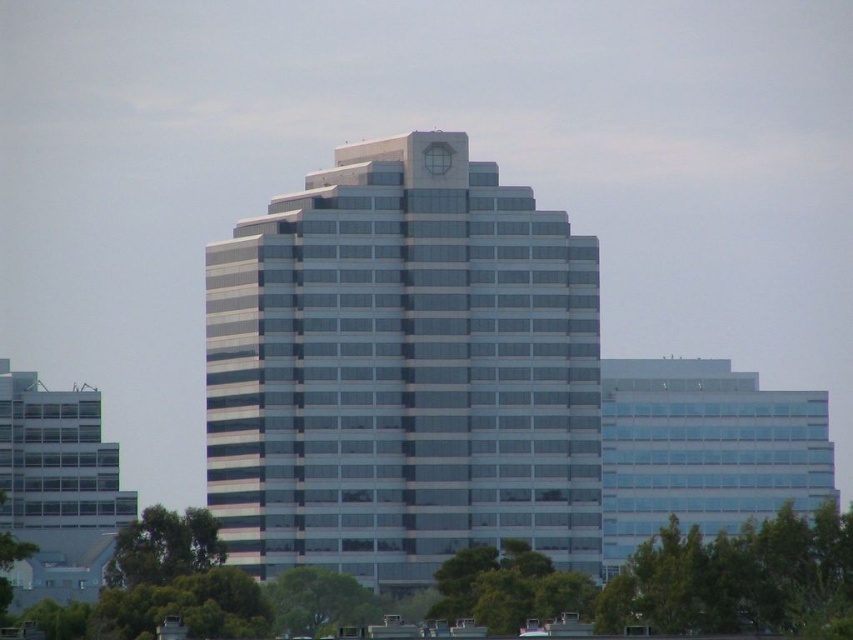
Who is shorter, glassy reflective building at center or matte glass building at left?

matte glass building at left is shorter.

Which is behind, point (454, 163) or point (26, 493)?

The point (26, 493) is behind.

This screenshot has height=640, width=853. I want to click on glassy reflective building at center, so pyautogui.click(x=402, y=371).

Between transparent glass building at right and matte glass building at left, which one has more height?

matte glass building at left

Is point (654, 513) behind point (59, 518)?

That is False.

The image size is (853, 640). Identify the location of transparent glass building at right. (703, 449).

Is point (515, 291) farther from camera compared to point (128, 538)?

No, (515, 291) is in front of (128, 538).

Does glassy reflective building at center appear on the right side of green leafy tree at lower left?

Indeed, glassy reflective building at center is positioned on the right side of green leafy tree at lower left.

This screenshot has width=853, height=640. Identify the location of glassy reflective building at center. (402, 371).